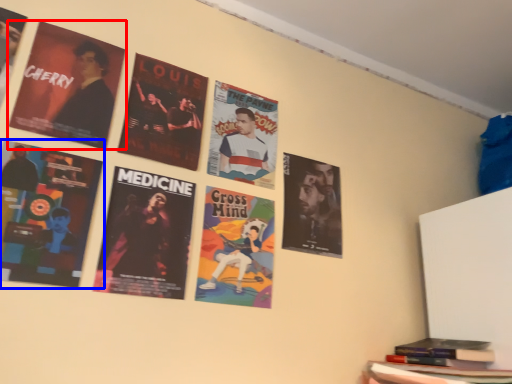
Question: Which of the following is the closest to the observer, poster (highlighted by a red box) or poster (highlighted by a blue box)?

Choices:
 (A) poster
 (B) poster

Answer: (B)